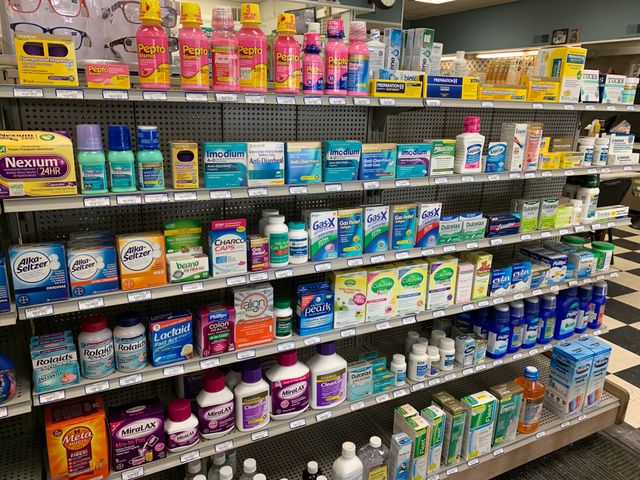
Find the location of a particular element. plain gray rug is located at coordinates (x=587, y=462).